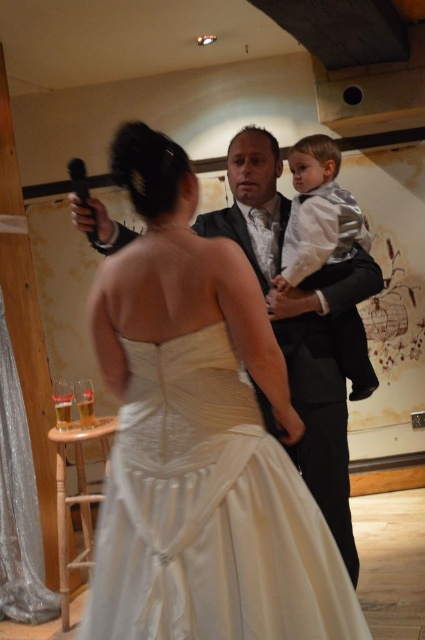
You are a photographer at the wedding reception. You need to capture a photo of the satin dress at center and the silver shiny suit at center. Based on their positions, which one should you focus on first to ensure both are in frame?

The satin dress at center is located below the silver shiny suit at center, so you should focus on the silver shiny suit at center first to ensure both are in frame.

Based on the scene description, where is the satin dress at center located in terms of coordinates?

The satin dress at center is located at coordinates point (209, 513).

You are a photographer positioned at the back of the reception hall. You want to capture a closeup shot of the satin dress at center without moving closer. Can you achieve this with your current camera settings that allow focusing up to 4 feet?

The satin dress at center is 4.35 feet away from viewer. Since the camera can focus up to 4 feet, it cannot capture a clear closeup at 4.35 feet. Move closer or adjust settings.